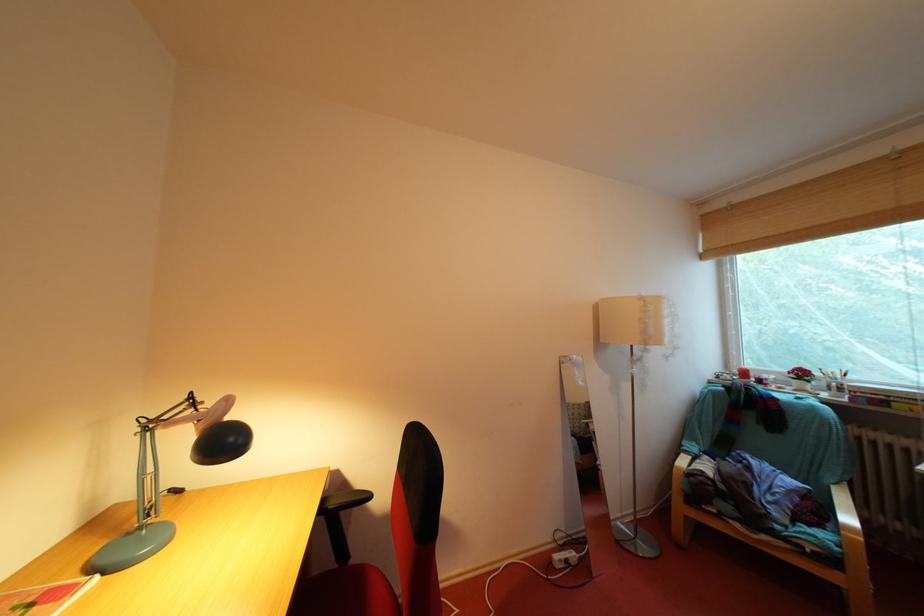
The location [834,381] corresponds to which object?

This point indicates the white pen holder.